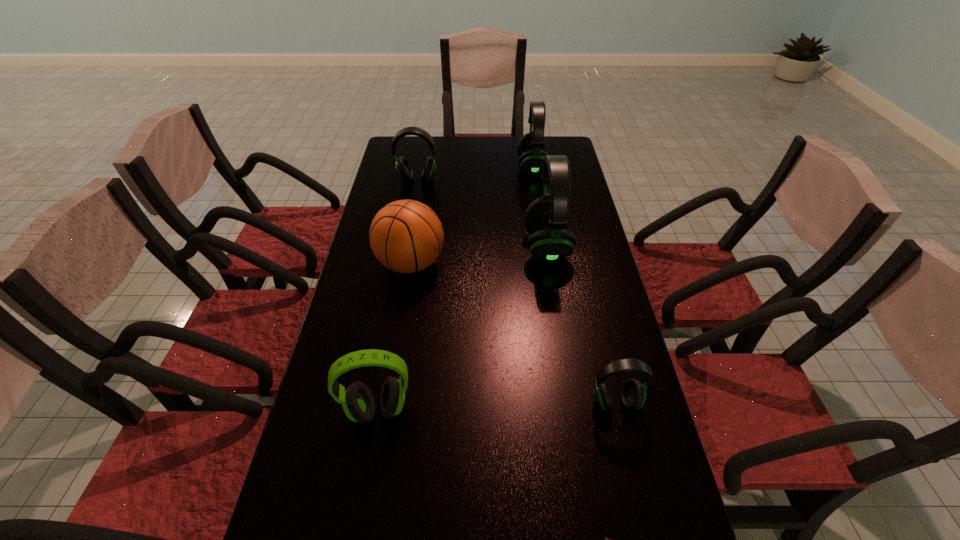
The height and width of the screenshot is (540, 960). I want to click on basketball located at the left edge, so click(x=406, y=236).

This screenshot has height=540, width=960. Find the location of `object that is at the far right corner`. object that is at the far right corner is located at coordinates (532, 147).

In the image, there is a desktop. Identify the location of free space at the far edge. This screenshot has height=540, width=960. (460, 164).

This screenshot has height=540, width=960. In the image, there is a desktop. Find the location of `vacant area at the left edge`. vacant area at the left edge is located at coordinates (399, 322).

The image size is (960, 540). In the image, there is a desktop. In order to click on free space at the right edge in this screenshot , I will do `click(607, 486)`.

The image size is (960, 540). Find the location of `vacant space that's between the green headset and the third farthest black headset`. vacant space that's between the green headset and the third farthest black headset is located at coordinates 463,328.

Where is `empty space that is in between the green headset and the second nearest black headset`? empty space that is in between the green headset and the second nearest black headset is located at coordinates (463, 328).

This screenshot has width=960, height=540. I want to click on free area in between the leftmost black headset and the green headset, so click(397, 295).

Where is `empty space that is in between the sixth shortest object and the green headset`? The height and width of the screenshot is (540, 960). empty space that is in between the sixth shortest object and the green headset is located at coordinates (455, 288).

Image resolution: width=960 pixels, height=540 pixels. Find the location of `vacant space in between the tallest headset and the basketball`. vacant space in between the tallest headset and the basketball is located at coordinates (479, 255).